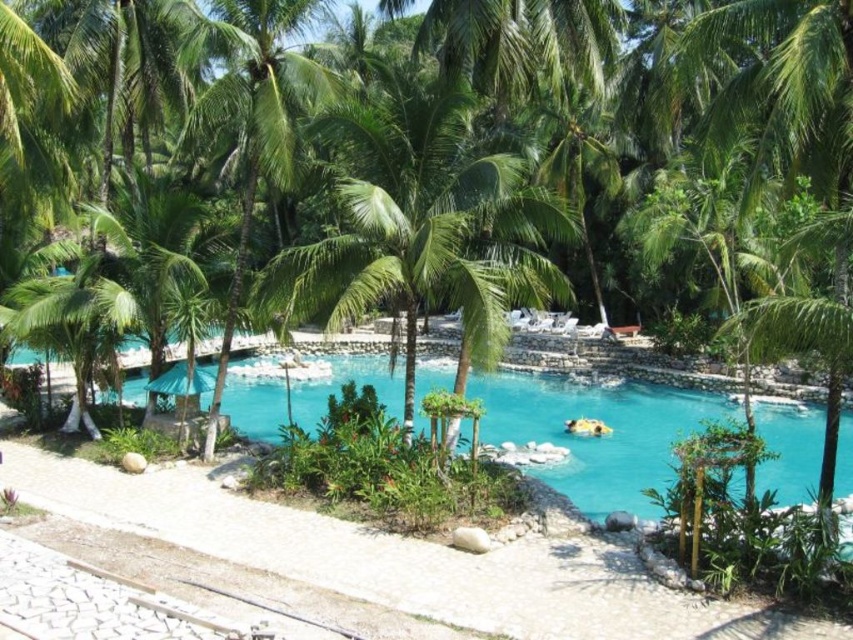
Question: Which object appears closest to the camera in this image?

Choices:
 (A) turquoise glossy water at center
 (B) green leafy palm tree at center

Answer: (A)

Question: Is green leafy palm tree at center above turquoise glossy water at center?

Choices:
 (A) no
 (B) yes

Answer: (B)

Question: Among these objects, which one is nearest to the camera?

Choices:
 (A) green leafy palm tree at center
 (B) turquoise glossy water at center

Answer: (B)

Question: In this image, where is green leafy palm tree at center located relative to turquoise glossy water at center?

Choices:
 (A) right
 (B) left

Answer: (A)

Question: Can you confirm if green leafy palm tree at center is positioned above turquoise glossy water at center?

Choices:
 (A) no
 (B) yes

Answer: (B)